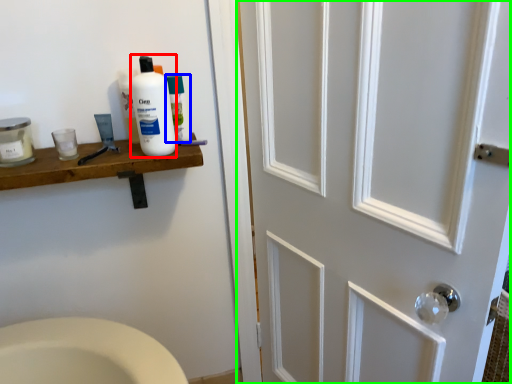
Question: Considering the real-world distances, which object is closest to cleaning product (highlighted by a red box)? mouthwash (highlighted by a blue box) or door (highlighted by a green box).

Choices:
 (A) mouthwash
 (B) door

Answer: (A)